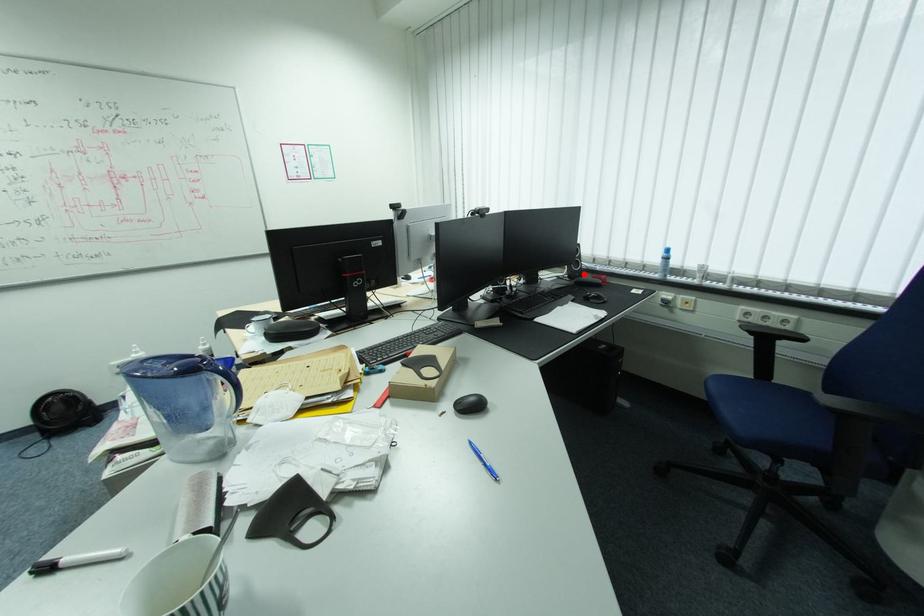
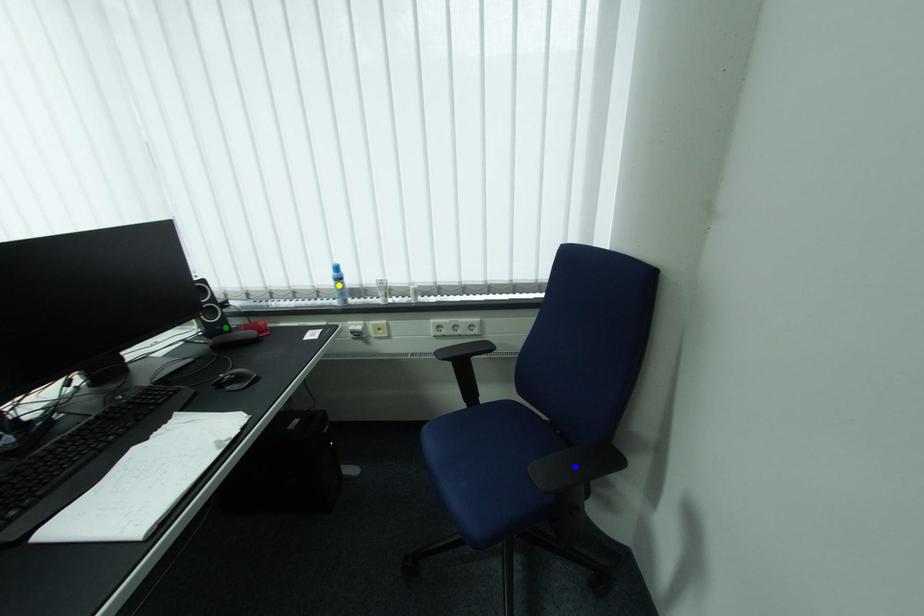
Question: I am providing you with two images of the same scene from different viewpoints. A red point is marked on the first image. You are given multiple points on the second image. Which point in image 2 is actually the same real-world point as the red point in image 1?

Choices:
 (A) blue point
 (B) green point
 (C) yellow point

Answer: (B)